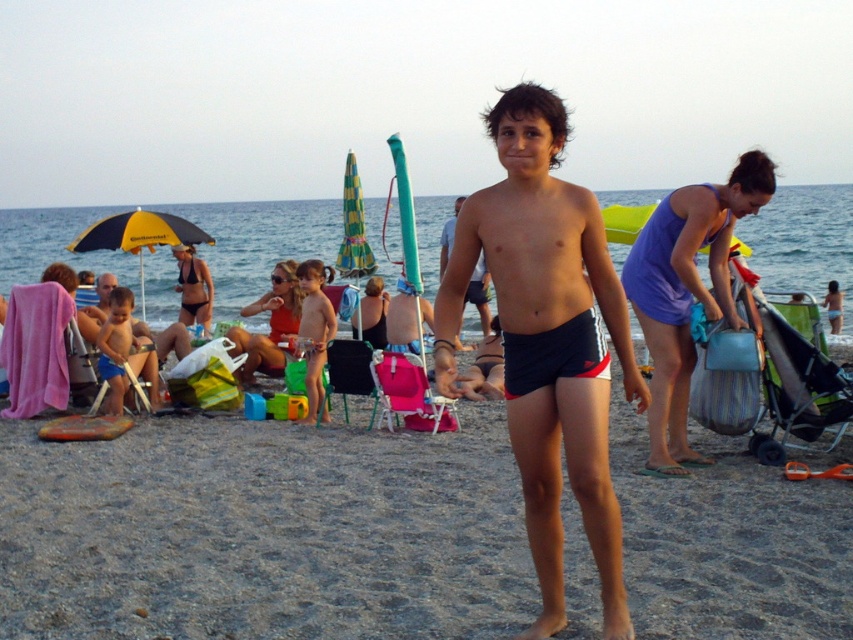
Does black fabric shorts at center have a lesser height compared to smooth black shorts at center?

Yes, black fabric shorts at center is shorter than smooth black shorts at center.

Between black fabric shorts at center and smooth black shorts at center, which one is positioned higher?

smooth black shorts at center

Is point (770, 490) positioned after point (483, 262)?

No, (770, 490) is in front of (483, 262).

The height and width of the screenshot is (640, 853). In order to click on black fabric shorts at center in this screenshot , I will do `click(264, 531)`.

Locate an element on the screen. This screenshot has height=640, width=853. black fabric shorts at center is located at coordinates (264, 531).

Who is more forward, (x=306, y=480) or (x=566, y=134)?

Point (x=566, y=134) is more forward.

At what (x,y) coordinates should I click in order to perform the action: click on black fabric shorts at center. Please return your answer as a coordinate pair (x, y). Looking at the image, I should click on (264, 531).

Does smooth tan skin at center appear on the left side of smooth black shorts at center?

Correct, you'll find smooth tan skin at center to the left of smooth black shorts at center.

Is smooth tan skin at center shorter than smooth black shorts at center?

Yes, smooth tan skin at center is shorter than smooth black shorts at center.

In order to click on smooth tan skin at center in this screenshot , I will do `click(314, 333)`.

Where is `smooth tan skin at center`? This screenshot has height=640, width=853. smooth tan skin at center is located at coordinates (314, 333).